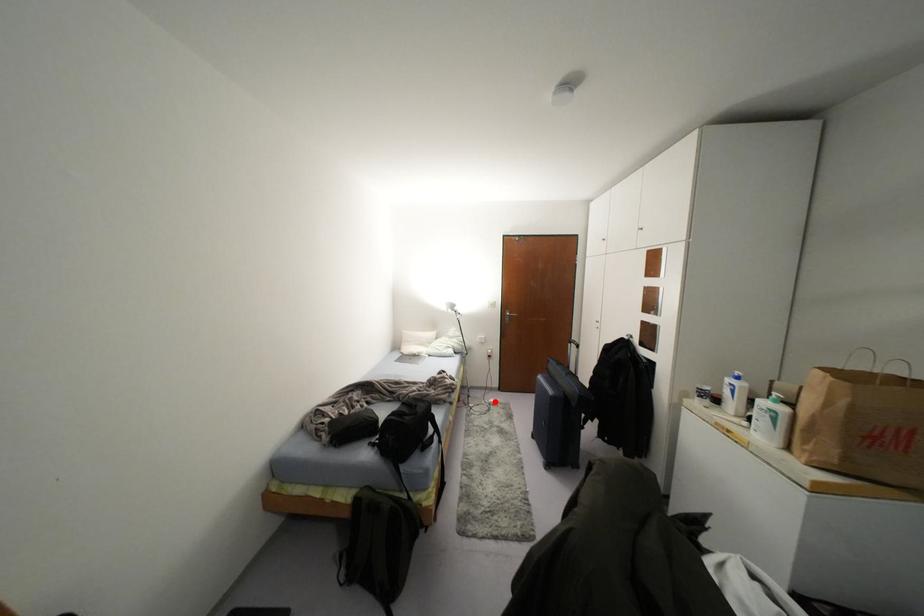
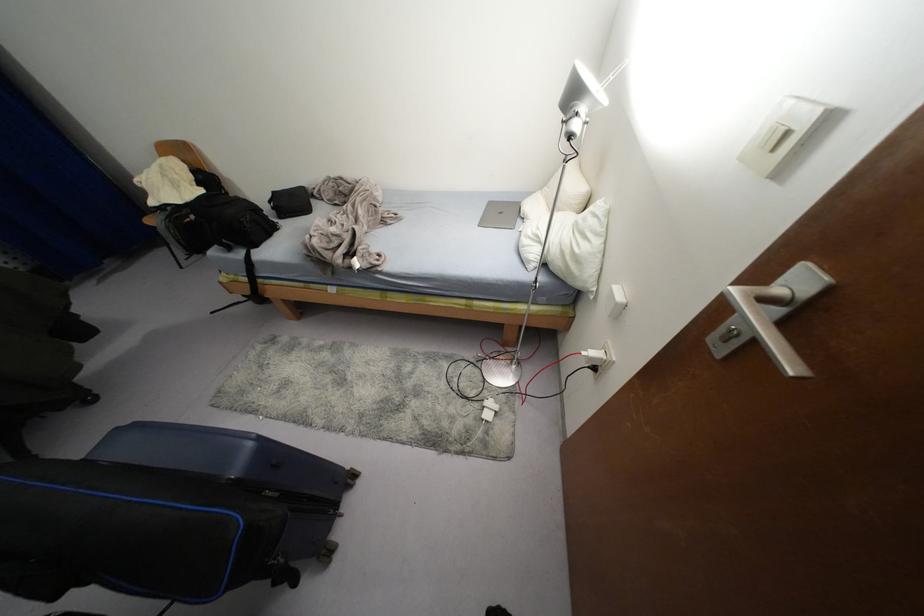
Find the pixel in the second image that matches the highlighted location in the first image.

(487, 416)